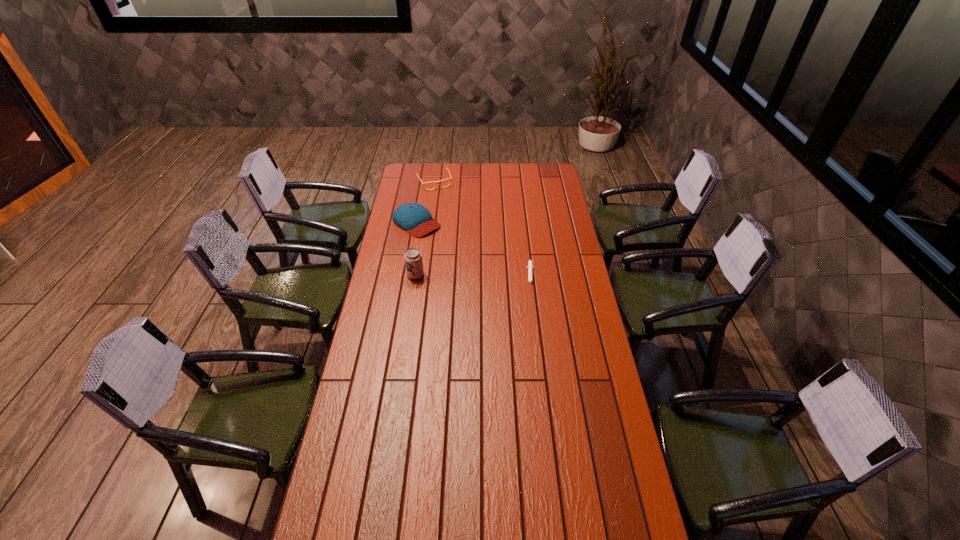
Locate an element on the screen. The height and width of the screenshot is (540, 960). object that is the closest to the second farthest object is located at coordinates (436, 182).

At what (x,y) coordinates should I click in order to perform the action: click on free spot that satisfies the following two spatial constraints: 1. on the front side of the farthest object; 2. on the right side of the rightmost object. Please return your answer as a coordinate pair (x, y). Image resolution: width=960 pixels, height=540 pixels. Looking at the image, I should click on (421, 276).

Where is `free space that satisfies the following two spatial constraints: 1. on the back side of the tallest object; 2. on the left side of the farthest object`? The image size is (960, 540). free space that satisfies the following two spatial constraints: 1. on the back side of the tallest object; 2. on the left side of the farthest object is located at coordinates (430, 182).

What are the coordinates of `vacant space that satisfies the following two spatial constraints: 1. on the front side of the third shortest object; 2. on the right side of the tallest object` in the screenshot? It's located at (407, 275).

At what (x,y) coordinates should I click in order to perform the action: click on vacant position in the image that satisfies the following two spatial constraints: 1. on the front side of the beer can; 2. on the right side of the rightmost object. Please return your answer as a coordinate pair (x, y). The image size is (960, 540). Looking at the image, I should click on coord(416,276).

Image resolution: width=960 pixels, height=540 pixels. I want to click on blank space that satisfies the following two spatial constraints: 1. on the front side of the beer can; 2. on the left side of the baseball cap, so click(407, 275).